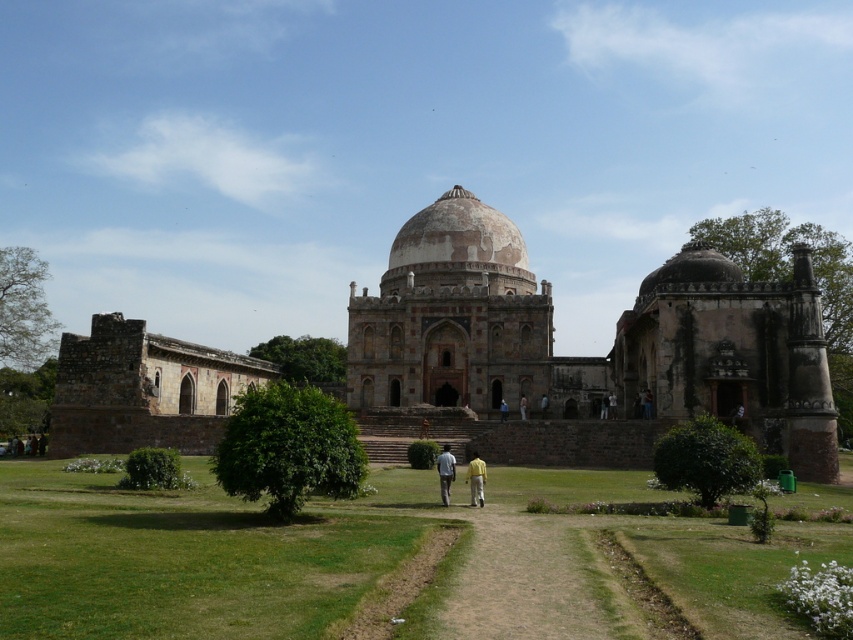
You are a tour guide explaining the historical site to visitors. You notice a light blue fabric shirt at center and a dark green fabric couple at lower left. Which of these two has a smaller width?

The light blue fabric shirt at center has a smaller width than the dark green fabric couple at lower left according to the description.

Based on the photo, you are standing at the entrance of the historical structure and see the green grass at center and the light blue fabric shirt at center. Which object takes up more space in the scene?

The green grass at center takes up more space in the scene as it is bigger than the light blue fabric shirt at center.

You are standing at the entrance of the historical structure and notice both the green grass at center and the light blue fabric shirt at center. Which object is closer to you?

The light blue fabric shirt at center is closer to you because it is positioned above the green grass at center, which is underneath it.